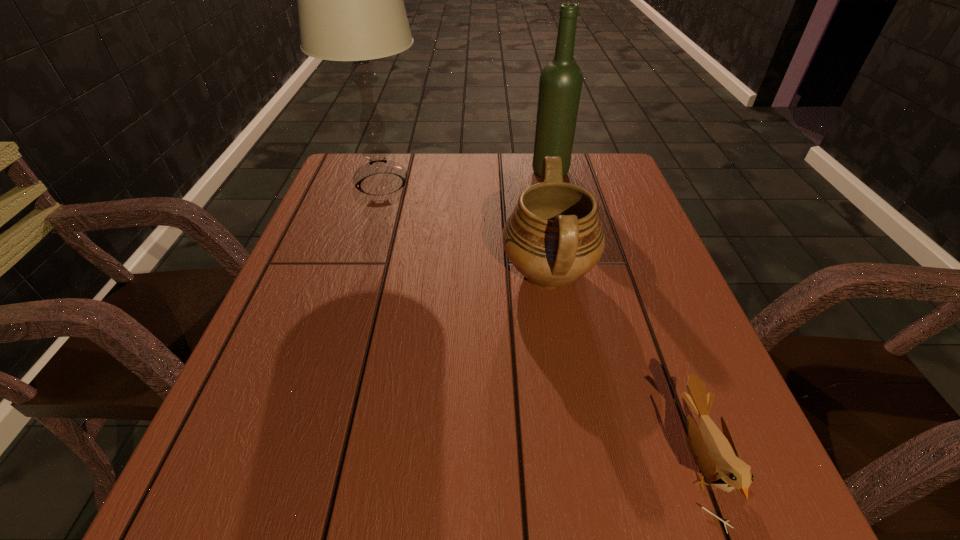
Locate an element on the screen. vacant space at the far right corner of the desktop is located at coordinates (600, 163).

At what (x,y) coordinates should I click in order to perform the action: click on blank space at the near right corner of the desktop. Please return your answer as a coordinate pair (x, y). This screenshot has width=960, height=540. Looking at the image, I should click on (688, 502).

Locate an element on the screen. free space between the tallest object and the bird is located at coordinates (540, 322).

Locate an element on the screen. The height and width of the screenshot is (540, 960). free point between the third tallest object and the tallest object is located at coordinates (465, 229).

Find the location of a particular element. The width and height of the screenshot is (960, 540). free area in between the nearest object and the tallest object is located at coordinates (540, 322).

The image size is (960, 540). Find the location of `free area in between the urn and the leftmost object`. free area in between the urn and the leftmost object is located at coordinates (465, 229).

The height and width of the screenshot is (540, 960). What are the coordinates of `vacant space that is in between the urn and the leftmost object` in the screenshot? It's located at (465, 229).

At what (x,y) coordinates should I click in order to perform the action: click on free space between the wine bottle and the rightmost object. Please return your answer as a coordinate pair (x, y). Looking at the image, I should click on (625, 316).

Find the location of `vacant area that lies between the wine bottle and the tallest object`. vacant area that lies between the wine bottle and the tallest object is located at coordinates (466, 178).

You are a GUI agent. You are given a task and a screenshot of the screen. Output one action in this format:
    pyautogui.click(x=<x>, y=<y>)
    Task: Click on the vacant area that lies between the table lamp and the second tallest object
    
    Given the screenshot: What is the action you would take?
    pyautogui.click(x=466, y=178)